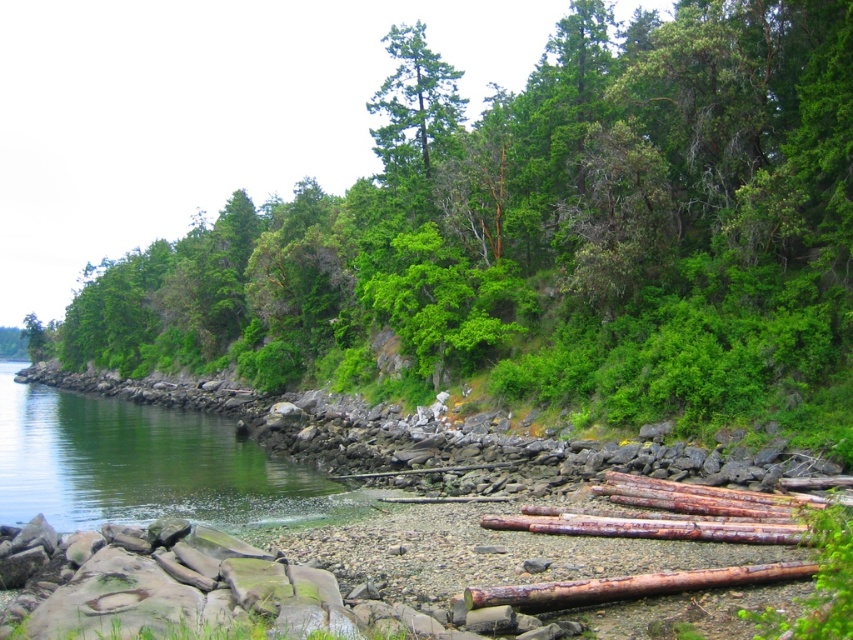
At what (x,y) coordinates should I click in order to perform the action: click on green smooth water at lower left. Please return your answer as a coordinate pair (x, y). This screenshot has height=640, width=853. Looking at the image, I should click on (144, 465).

Can you confirm if green smooth water at lower left is thinner than green matte tree at upper center?

No.

What do you see at coordinates (144, 465) in the screenshot? I see `green smooth water at lower left` at bounding box center [144, 465].

Image resolution: width=853 pixels, height=640 pixels. Identify the location of green smooth water at lower left. (144, 465).

Can you confirm if green smooth water at lower left is bigger than rusty wood log at lower right?

Yes, green smooth water at lower left is bigger than rusty wood log at lower right.

Is green smooth water at lower left to the right of rusty wood log at lower right from the viewer's perspective?

Incorrect, green smooth water at lower left is not on the right side of rusty wood log at lower right.

This screenshot has width=853, height=640. I want to click on green smooth water at lower left, so click(144, 465).

Locate an element on the screen. green smooth water at lower left is located at coordinates (144, 465).

Is green leafy tree at center thinner than rusty wood log at lower right?

In fact, green leafy tree at center might be wider than rusty wood log at lower right.

Can you confirm if green leafy tree at center is positioned to the left of rusty wood log at lower right?

Indeed, green leafy tree at center is positioned on the left side of rusty wood log at lower right.

Find the location of `green leafy tree at center`. green leafy tree at center is located at coordinates (547, 232).